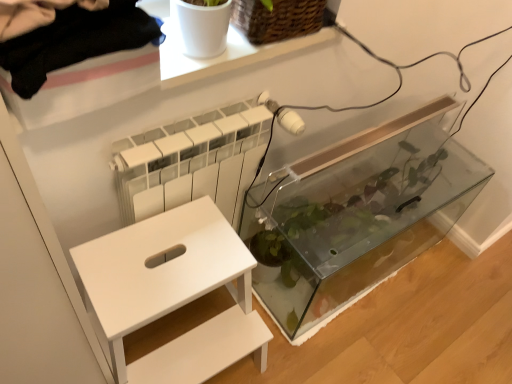
Question: Is woven brown basket at upper center outside white matte step stool at lower left?

Choices:
 (A) no
 (B) yes

Answer: (B)

Question: Is the surface of woven brown basket at upper center in direct contact with white matte step stool at lower left?

Choices:
 (A) yes
 (B) no

Answer: (B)

Question: Can you confirm if woven brown basket at upper center is bigger than white matte step stool at lower left?

Choices:
 (A) no
 (B) yes

Answer: (A)

Question: From the image's perspective, is woven brown basket at upper center located above white matte step stool at lower left?

Choices:
 (A) no
 (B) yes

Answer: (B)

Question: Is the depth of woven brown basket at upper center greater than that of white matte step stool at lower left?

Choices:
 (A) no
 (B) yes

Answer: (B)

Question: Relative to white matte step stool at lower left, is woven brown basket at upper center in front or behind?

Choices:
 (A) behind
 (B) front

Answer: (A)

Question: Is woven brown basket at upper center to the left or to the right of white matte step stool at lower left in the image?

Choices:
 (A) left
 (B) right

Answer: (B)

Question: Considering the positions of woven brown basket at upper center and white matte step stool at lower left in the image, is woven brown basket at upper center wider or thinner than white matte step stool at lower left?

Choices:
 (A) thin
 (B) wide

Answer: (A)

Question: From a real-world perspective, relative to white matte step stool at lower left, is woven brown basket at upper center vertically above or below?

Choices:
 (A) above
 (B) below

Answer: (A)

Question: Is woven brown basket at upper center situated inside transparent glass tank at center or outside?

Choices:
 (A) outside
 (B) inside

Answer: (A)

Question: From the image's perspective, is woven brown basket at upper center located above or below transparent glass tank at center?

Choices:
 (A) above
 (B) below

Answer: (A)

Question: In the image, is woven brown basket at upper center on the left side or the right side of transparent glass tank at center?

Choices:
 (A) right
 (B) left

Answer: (B)

Question: In terms of width, does woven brown basket at upper center look wider or thinner when compared to transparent glass tank at center?

Choices:
 (A) thin
 (B) wide

Answer: (A)

Question: Based on their sizes in the image, would you say white matte step stool at lower left is bigger or smaller than transparent glass tank at center?

Choices:
 (A) small
 (B) big

Answer: (A)

Question: From their relative heights in the image, would you say white matte step stool at lower left is taller or shorter than transparent glass tank at center?

Choices:
 (A) short
 (B) tall

Answer: (B)